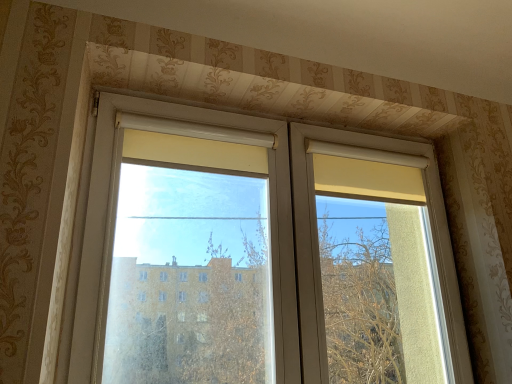
Question: From a real-world perspective, is transparent plastic window screen at center positioned under transparent glass window at center based on gravity?

Choices:
 (A) yes
 (B) no

Answer: (A)

Question: Is transparent plastic window screen at center not inside transparent glass window at center?

Choices:
 (A) yes
 (B) no

Answer: (B)

Question: Can you confirm if transparent plastic window screen at center is bigger than transparent glass window at center?

Choices:
 (A) yes
 (B) no

Answer: (B)

Question: Is transparent plastic window screen at center to the left of transparent glass window at center from the viewer's perspective?

Choices:
 (A) no
 (B) yes

Answer: (B)

Question: Is transparent plastic window screen at center facing away from transparent glass window at center?

Choices:
 (A) no
 (B) yes

Answer: (B)

Question: Can you confirm if transparent plastic window screen at center is positioned to the right of transparent glass window at center?

Choices:
 (A) yes
 (B) no

Answer: (B)

Question: From a real-world perspective, is transparent glass window at center located higher than transparent plastic window screen at center?

Choices:
 (A) no
 (B) yes

Answer: (B)

Question: Would you say transparent glass window at center is outside transparent plastic window screen at center?

Choices:
 (A) no
 (B) yes

Answer: (A)

Question: Can you confirm if transparent glass window at center is smaller than transparent plastic window screen at center?

Choices:
 (A) no
 (B) yes

Answer: (A)

Question: Does transparent glass window at center touch transparent plastic window screen at center?

Choices:
 (A) yes
 (B) no

Answer: (A)

Question: Is transparent plastic window screen at center inside transparent glass window at center?

Choices:
 (A) no
 (B) yes

Answer: (B)

Question: Considering the relative sizes of transparent glass window at center and transparent plastic window screen at center in the image provided, is transparent glass window at center wider than transparent plastic window screen at center?

Choices:
 (A) yes
 (B) no

Answer: (B)

Question: From the image's perspective, relative to transparent glass window at center, is transparent plastic window screen at center above or below?

Choices:
 (A) above
 (B) below

Answer: (A)